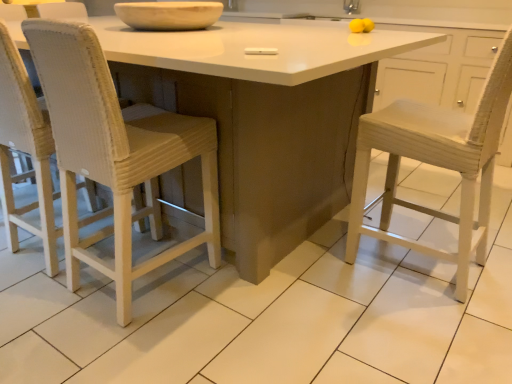
Find the location of a particular element. This screenshot has width=512, height=384. silver metallic faucet at upper right is located at coordinates (351, 6).

This screenshot has height=384, width=512. What do you see at coordinates (169, 15) in the screenshot? I see `matte white bowl at upper center` at bounding box center [169, 15].

This screenshot has height=384, width=512. I want to click on woven white chair at left, so click(x=115, y=154).

Based on their sizes in the image, would you say woven white chair at left is bigger or smaller than matte white bowl at upper center?

In the image, woven white chair at left appears to be larger than matte white bowl at upper center.

Which is closer, (130, 216) or (131, 13)?

Point (130, 216)

From the image's perspective, would you say woven white chair at left is positioned over matte white bowl at upper center?

No, from the image's perspective, woven white chair at left is not on top of matte white bowl at upper center.

Is the depth of woven white chair at left greater than that of matte white bowl at upper center?

No, woven white chair at left is in front of matte white bowl at upper center.

Where is `faucet behind the white matte table at center`? The image size is (512, 384). faucet behind the white matte table at center is located at coordinates (351, 6).

Is silver metallic faucet at upper right bigger than white matte table at center?

No, silver metallic faucet at upper right is not bigger than white matte table at center.

Would you say silver metallic faucet at upper right is outside white matte table at center?

That's correct, silver metallic faucet at upper right is outside of white matte table at center.

Consider the image. Are silver metallic faucet at upper right and white matte table at center beside each other?

They are not placed beside each other.

In terms of height, does woven white chair at left look taller or shorter compared to white matte table at center?

woven white chair at left is taller than white matte table at center.

Which is less distant, (64, 198) or (311, 220)?

Point (64, 198) appears to be closer to the viewer than point (311, 220).

From a real-world perspective, is woven white chair at left on white matte table at center?

Indeed, from a real-world perspective, woven white chair at left stands above white matte table at center.

Could you tell me if white matte table at center is turned towards matte white bowl at upper center?

No, white matte table at center is not turned towards matte white bowl at upper center.

Considering the points (247, 126) and (163, 3), which point is in front, point (247, 126) or point (163, 3)?

Point (247, 126)

Is there a large distance between white matte table at center and matte white bowl at upper center?

white matte table at center is actually quite close to matte white bowl at upper center.

The width and height of the screenshot is (512, 384). Identify the location of bowl behind the white matte table at center. (169, 15).

From the image's perspective, is white matte table at center located above silver metallic faucet at upper right?

No, from the image's perspective, white matte table at center is not over silver metallic faucet at upper right.

Is silver metallic faucet at upper right surrounded by white matte table at center?

Definitely not — silver metallic faucet at upper right is not inside white matte table at center.

Is white matte table at center bigger than silver metallic faucet at upper right?

Yes.

Consider the image. Considering the sizes of white matte table at center and silver metallic faucet at upper right in the image, is white matte table at center taller or shorter than silver metallic faucet at upper right?

Clearly, white matte table at center is taller compared to silver metallic faucet at upper right.

Find the location of a particular element. The width and height of the screenshot is (512, 384). faucet that appears above the matte white bowl at upper center (from the image's perspective) is located at coordinates coord(351,6).

Are silver metallic faucet at upper right and matte white bowl at upper center far apart?

silver metallic faucet at upper right is far away from matte white bowl at upper center.

Does silver metallic faucet at upper right come behind matte white bowl at upper center?

Yes, it is.

Measure the distance from matte white bowl at upper center to white matte table at center.

The distance of matte white bowl at upper center from white matte table at center is 22.95 inches.

Does matte white bowl at upper center have a lesser height compared to white matte table at center?

Yes.

Who is more distant, matte white bowl at upper center or white matte table at center?

matte white bowl at upper center is further from the camera.

At what (x,y) coordinates should I click in order to perform the action: click on table in front of the matte white bowl at upper center. Please return your answer as a coordinate pair (x, y). Image resolution: width=512 pixels, height=384 pixels. Looking at the image, I should click on (264, 117).

Image resolution: width=512 pixels, height=384 pixels. Find the location of `chair below the matte white bowl at upper center (from the image's perspective)`. chair below the matte white bowl at upper center (from the image's perspective) is located at coordinates (115, 154).

Image resolution: width=512 pixels, height=384 pixels. What are the coordinates of `table that is in front of the silver metallic faucet at upper right` in the screenshot? It's located at (264, 117).

Based on their spatial positions, is woven white chair at left or silver metallic faucet at upper right further from white matte table at center?

Among the two, silver metallic faucet at upper right is located further to white matte table at center.

Which object lies nearer to the anchor point woven white chair at left, white matte table at center or silver metallic faucet at upper right?

white matte table at center lies closer to woven white chair at left than the other object.

Estimate the real-world distances between objects in this image. Which object is further from matte white bowl at upper center, woven white chair at left or white matte table at center?

The object further to matte white bowl at upper center is woven white chair at left.

From the image, which object appears to be farther from woven white chair at left, matte white bowl at upper center or silver metallic faucet at upper right?

Based on the image, silver metallic faucet at upper right appears to be further to woven white chair at left.

Consider the image. From the image, which object appears to be farther from woven white chair at left, white matte table at center or matte white bowl at upper center?

The object further to woven white chair at left is matte white bowl at upper center.

Which object lies nearer to the anchor point woven white chair at left, silver metallic faucet at upper right or white matte table at center?

Among the two, white matte table at center is located nearer to woven white chair at left.

Considering their positions, is silver metallic faucet at upper right positioned closer to white matte table at center than matte white bowl at upper center?

Among the two, matte white bowl at upper center is located nearer to white matte table at center.

Based on the photo, from the image, which object appears to be nearer to matte white bowl at upper center, silver metallic faucet at upper right or white matte table at center?

The object closer to matte white bowl at upper center is white matte table at center.

This screenshot has width=512, height=384. Find the location of `bowl between woven white chair at left and silver metallic faucet at upper right in the front-back direction`. bowl between woven white chair at left and silver metallic faucet at upper right in the front-back direction is located at coordinates (169, 15).

Locate an element on the screen. Image resolution: width=512 pixels, height=384 pixels. bowl between white matte table at center and silver metallic faucet at upper right in the front-back direction is located at coordinates (169, 15).

The height and width of the screenshot is (384, 512). What are the coordinates of `chair between white matte table at center and silver metallic faucet at upper right in the front-back direction` in the screenshot? It's located at (115, 154).

Where is `chair between white matte table at center and matte white bowl at upper center along the z-axis`? The width and height of the screenshot is (512, 384). chair between white matte table at center and matte white bowl at upper center along the z-axis is located at coordinates (115, 154).